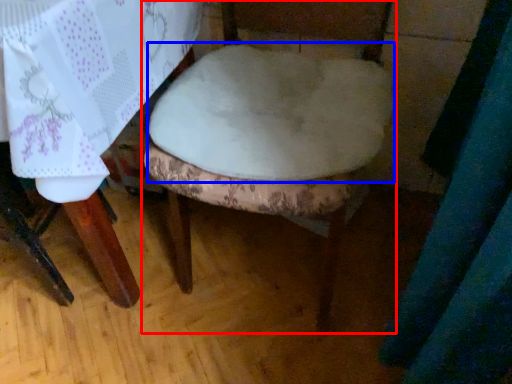
Question: Which of the following is the closest to the observer, chair (highlighted by a red box) or round table (highlighted by a blue box)?

Choices:
 (A) chair
 (B) round table

Answer: (A)